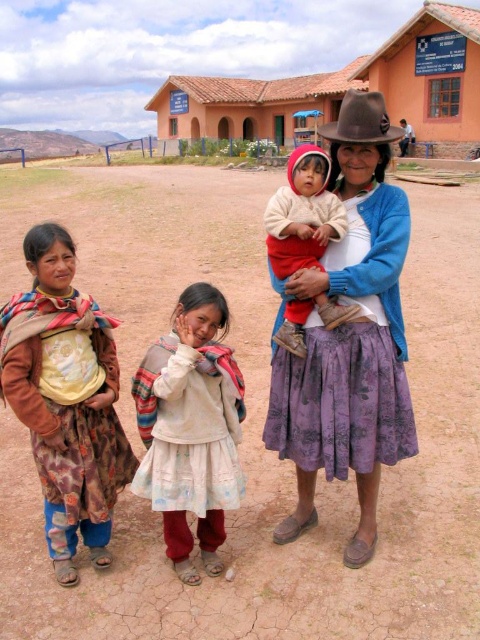
Between floral fabric shawl at left and brown felt hat at upper center, which one appears on the right side from the viewer's perspective?

From the viewer's perspective, brown felt hat at upper center appears more on the right side.

Does floral fabric shawl at left appear under brown felt hat at upper center?

Indeed, floral fabric shawl at left is positioned under brown felt hat at upper center.

The width and height of the screenshot is (480, 640). What do you see at coordinates (66, 400) in the screenshot?
I see `floral fabric shawl at left` at bounding box center [66, 400].

I want to click on floral fabric shawl at left, so [x=66, y=400].

Who is taller, purple floral skirt at center or terracotta clay building at center?

terracotta clay building at center is taller.

Is purple floral skirt at center positioned behind terracotta clay building at center?

No, purple floral skirt at center is closer to the viewer.

Does point (374, 160) come in front of point (409, 93)?

That is True.

At what (x,y) coordinates should I click in order to perform the action: click on purple floral skirt at center. Please return your answer as a coordinate pair (x, y). The height and width of the screenshot is (640, 480). Looking at the image, I should click on (348, 337).

Can you confirm if purple floral skirt at center is positioned below white soft sweater at center?

Yes, purple floral skirt at center is below white soft sweater at center.

Does purple floral skirt at center appear over white soft sweater at center?

Actually, purple floral skirt at center is below white soft sweater at center.

Measure the distance between purple floral skirt at center and camera.

purple floral skirt at center and camera are 3.13 meters apart.

Image resolution: width=480 pixels, height=640 pixels. Identify the location of purple floral skirt at center. (348, 337).